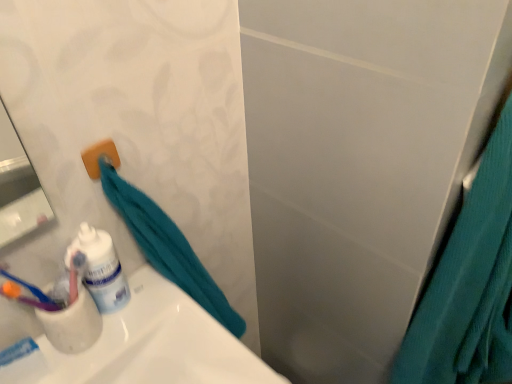
Question: From the image's perspective, is white matte toothpaste at lower left under teal fabric shower curtain at right?

Choices:
 (A) no
 (B) yes

Answer: (B)

Question: Is teal fabric shower curtain at right at the back of white matte toothpaste at lower left?

Choices:
 (A) yes
 (B) no

Answer: (B)

Question: Is the surface of white matte toothpaste at lower left in direct contact with teal fabric shower curtain at right?

Choices:
 (A) no
 (B) yes

Answer: (A)

Question: Considering the relative sizes of white matte toothpaste at lower left and teal fabric shower curtain at right in the image provided, is white matte toothpaste at lower left taller than teal fabric shower curtain at right?

Choices:
 (A) yes
 (B) no

Answer: (B)

Question: Is white matte toothpaste at lower left closer to camera compared to teal fabric shower curtain at right?

Choices:
 (A) yes
 (B) no

Answer: (B)

Question: Does white matte toothpaste at lower left have a smaller size compared to teal fabric shower curtain at right?

Choices:
 (A) no
 (B) yes

Answer: (B)

Question: Can you confirm if teal fabric shower curtain at right is bigger than white glossy toothpaste tube at lower left?

Choices:
 (A) yes
 (B) no

Answer: (A)

Question: From the image's perspective, would you say teal fabric shower curtain at right is shown under white glossy toothpaste tube at lower left?

Choices:
 (A) yes
 (B) no

Answer: (A)

Question: Could you tell me if teal fabric shower curtain at right is facing white glossy toothpaste tube at lower left?

Choices:
 (A) no
 (B) yes

Answer: (A)

Question: Is teal fabric shower curtain at right positioned far away from white glossy toothpaste tube at lower left?

Choices:
 (A) yes
 (B) no

Answer: (B)

Question: Considering the relative positions of teal fabric shower curtain at right and white glossy toothpaste tube at lower left in the image provided, is teal fabric shower curtain at right to the left of white glossy toothpaste tube at lower left from the viewer's perspective?

Choices:
 (A) no
 (B) yes

Answer: (A)

Question: Is teal fabric shower curtain at right positioned beyond the bounds of white glossy toothpaste tube at lower left?

Choices:
 (A) no
 (B) yes

Answer: (B)

Question: Is teal fabric shower curtain at right a part of white glossy toothpaste tube at lower left?

Choices:
 (A) no
 (B) yes

Answer: (A)